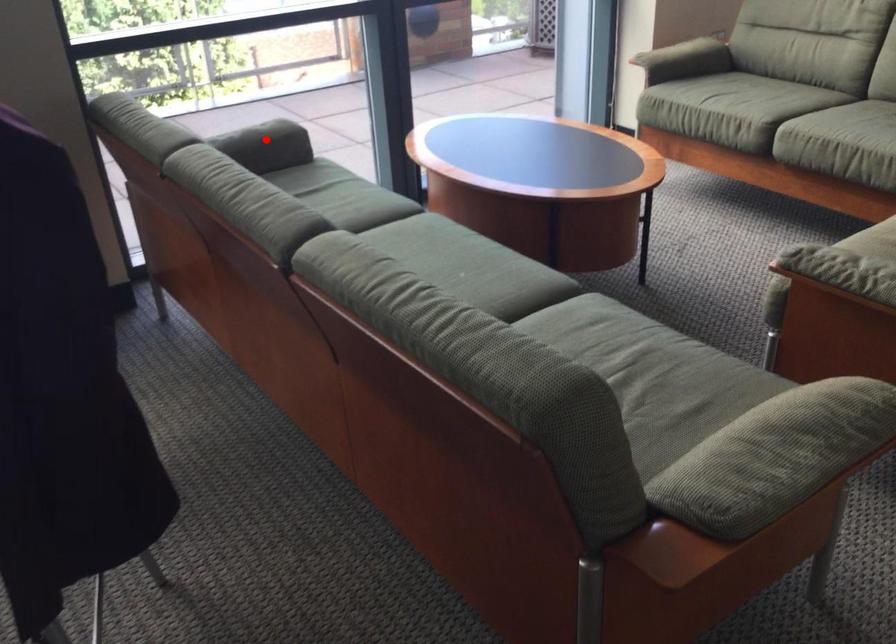
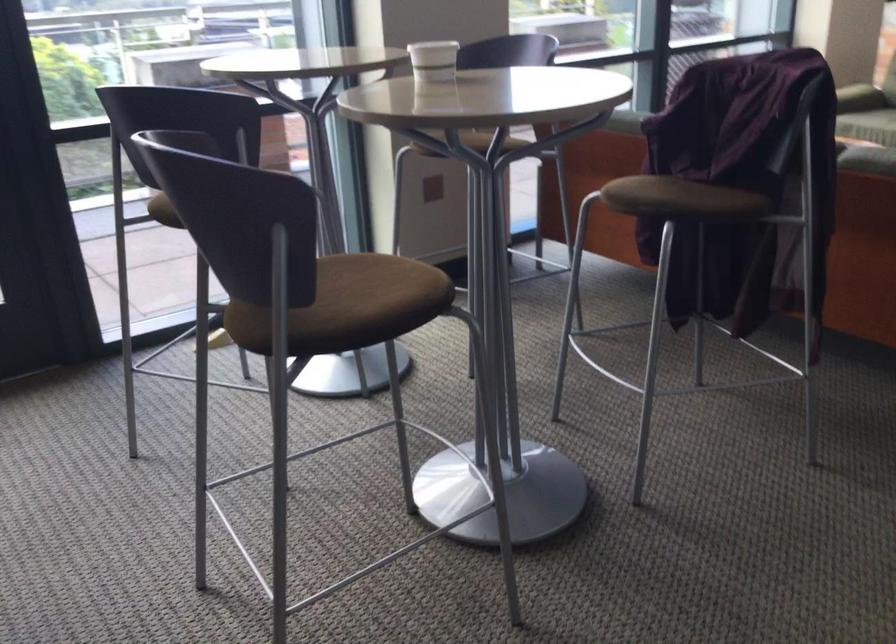
Question: I am providing you with two images of the same scene from different viewpoints. A red point is marked on the first image. At the location where the point appears in image 1, is it still visible in image 2?

Choices:
 (A) Yes
 (B) No

Answer: (B)